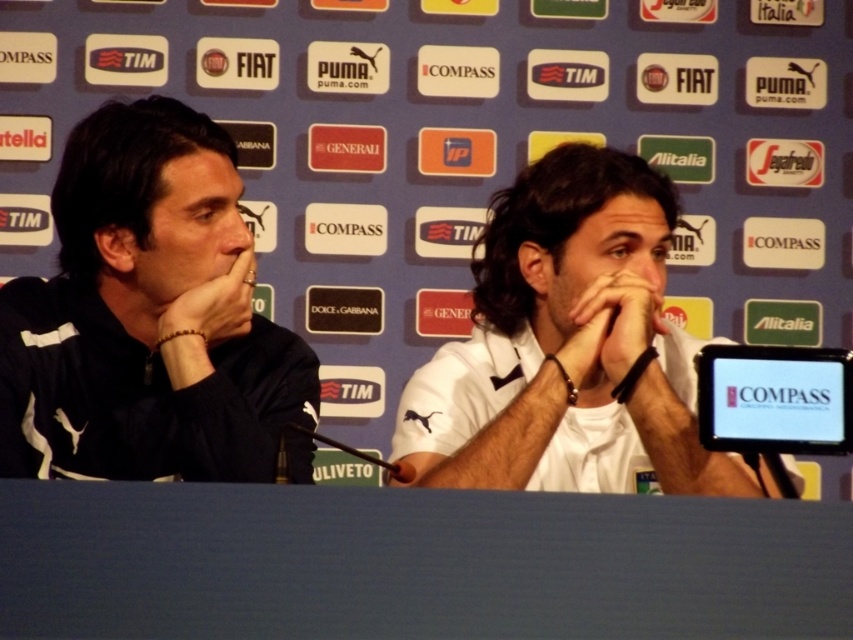
You are attending a press conference and need to hand a document to the person in the dark blue jersey at left. Since you are standing in front of the logos on the blue wall, which direction should you move to reach them first without passing through the white matte shirt at center?

The dark blue jersey at left is located above the white matte shirt at center, so you should move to your left to reach the person in the dark blue jersey at left first without passing through the white matte shirt at center.

You are attending a press conference and want to take a photo of the two points mentioned in the scene. Which point, point (239, 332) or point (482, 408), is closer to you?

Point (239, 332) is closer to the viewer than point (482, 408).

You are attending a press conference and notice two people wearing the dark blue jersey at left and the white matte shirt at center. Which of these two clothing items appears to be larger in size?

The white matte shirt at center is larger than the dark blue jersey at left.